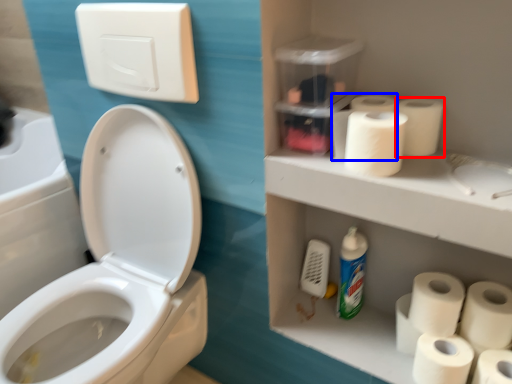
Question: Which of the following is the closest to the observer, toilet paper (highlighted by a red box) or paper towel (highlighted by a blue box)?

Choices:
 (A) toilet paper
 (B) paper towel

Answer: (A)